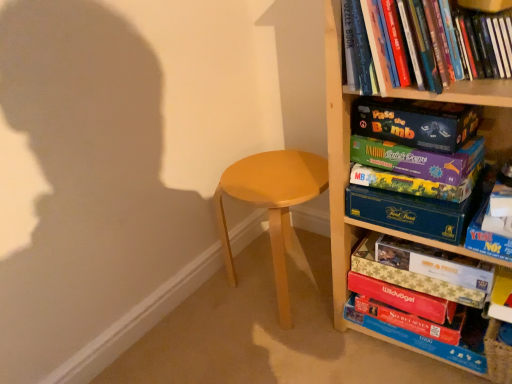
Where is `free location above red matte board game at lower right, acting as the first paperback book starting from the bottom (from a real-world perspective)`? This screenshot has height=384, width=512. free location above red matte board game at lower right, acting as the first paperback book starting from the bottom (from a real-world perspective) is located at coordinates (403, 296).